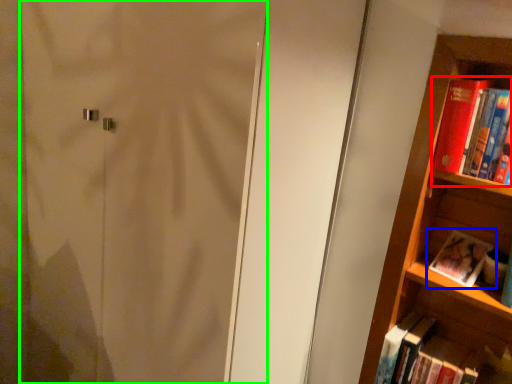
Question: Based on their relative distances, which object is farther from book (highlighted by a red box)? Choose from book (highlighted by a blue box) and screen door (highlighted by a green box).

Choices:
 (A) book
 (B) screen door

Answer: (B)